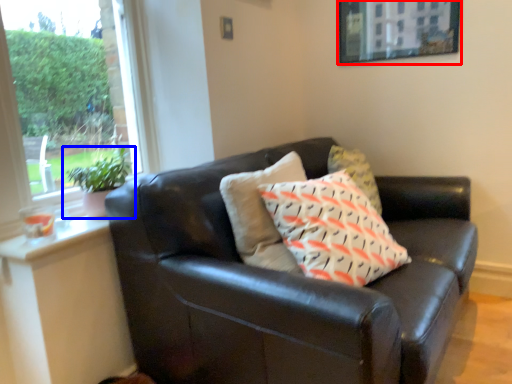
Question: Which object is further to the camera taking this photo, picture frame (highlighted by a red box) or houseplant (highlighted by a blue box)?

Choices:
 (A) picture frame
 (B) houseplant

Answer: (A)